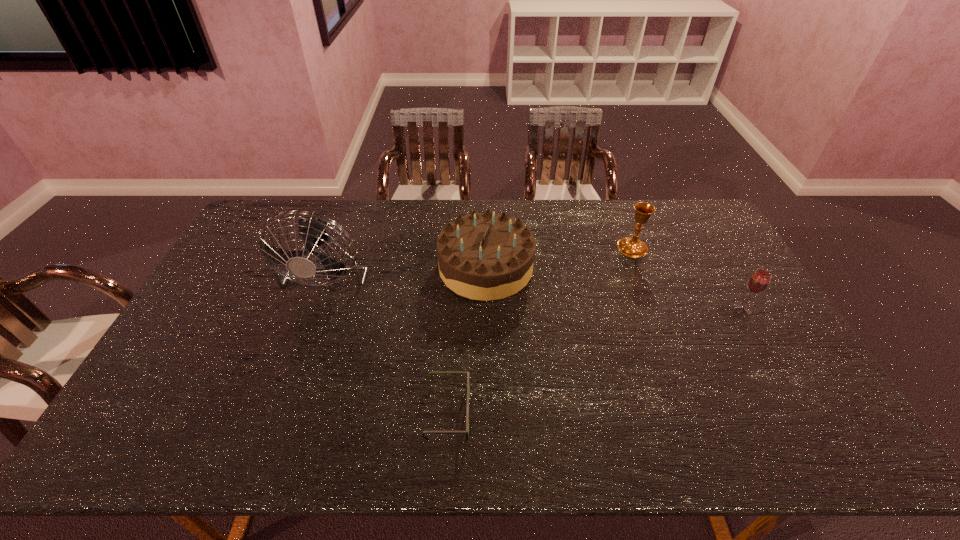
The image size is (960, 540). In order to click on vacant position in the image that satisfies the following two spatial constraints: 1. on the front-facing side of the wineglass; 2. on the left side of the leftmost object in this screenshot , I will do `click(314, 309)`.

This screenshot has height=540, width=960. I want to click on vacant region that satisfies the following two spatial constraints: 1. on the front-facing side of the leftmost object; 2. on the left side of the wineglass, so click(314, 309).

At what (x,y) coordinates should I click in order to perform the action: click on blank area in the image that satisfies the following two spatial constraints: 1. on the front side of the rightmost object; 2. on the lens of the nearest object. Please return your answer as a coordinate pair (x, y). Looking at the image, I should click on (801, 412).